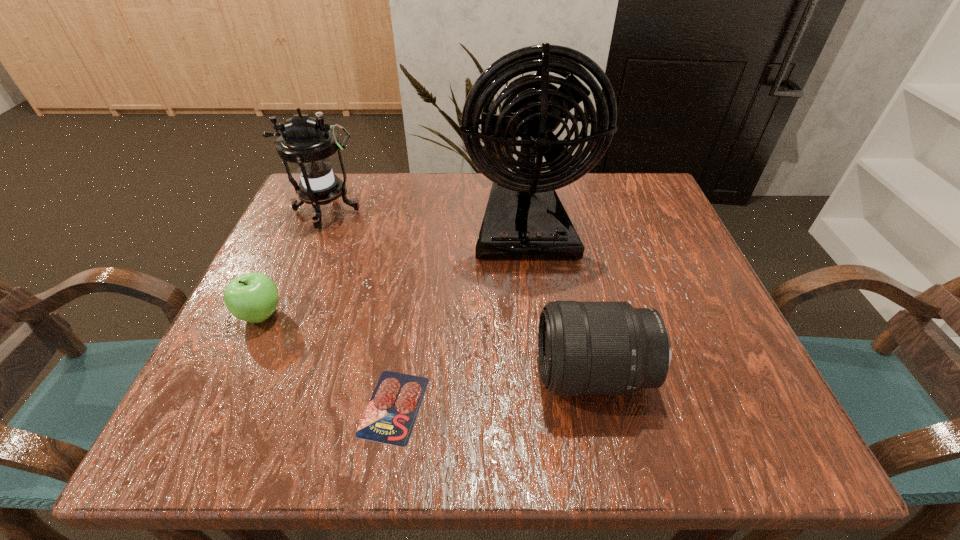
The width and height of the screenshot is (960, 540). In order to click on vacant space that is in between the fourth tallest object and the salami in this screenshot , I will do `click(327, 360)`.

Where is `vacant region between the fourth tallest object and the telephoto lens`? Image resolution: width=960 pixels, height=540 pixels. vacant region between the fourth tallest object and the telephoto lens is located at coordinates (427, 345).

What are the coordinates of `vacant point located between the fourth tallest object and the shortest object` in the screenshot? It's located at (327, 360).

The width and height of the screenshot is (960, 540). Identify the location of vacant space that is in between the shortest object and the lantern. (x=360, y=309).

The width and height of the screenshot is (960, 540). Find the location of `free space between the apple and the fourth shortest object`. free space between the apple and the fourth shortest object is located at coordinates (294, 263).

Point out which object is positioned as the third nearest to the shortest object. Please provide its 2D coordinates. Your answer should be formatted as a tuple, i.e. [(x, y)], where the tuple contains the x and y coordinates of a point satisfying the conditions above.

[(524, 218)]

Locate an element on the screen. This screenshot has width=960, height=540. object that stands as the third closest to the tallest object is located at coordinates (390, 416).

Locate an element on the screen. This screenshot has height=540, width=960. free space that satisfies the following two spatial constraints: 1. on the front side of the third object from left to right; 2. on the left side of the third farthest object is located at coordinates (218, 406).

Find the location of `free space that satisfies the following two spatial constraints: 1. on the front side of the fourth shortest object; 2. on the left side of the salami`. free space that satisfies the following two spatial constraints: 1. on the front side of the fourth shortest object; 2. on the left side of the salami is located at coordinates (244, 406).